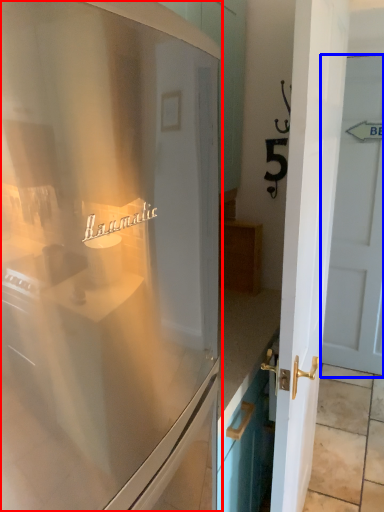
Question: Which of the following is the closest to the observer, refrigerator (highlighted by a red box) or door (highlighted by a blue box)?

Choices:
 (A) refrigerator
 (B) door

Answer: (A)